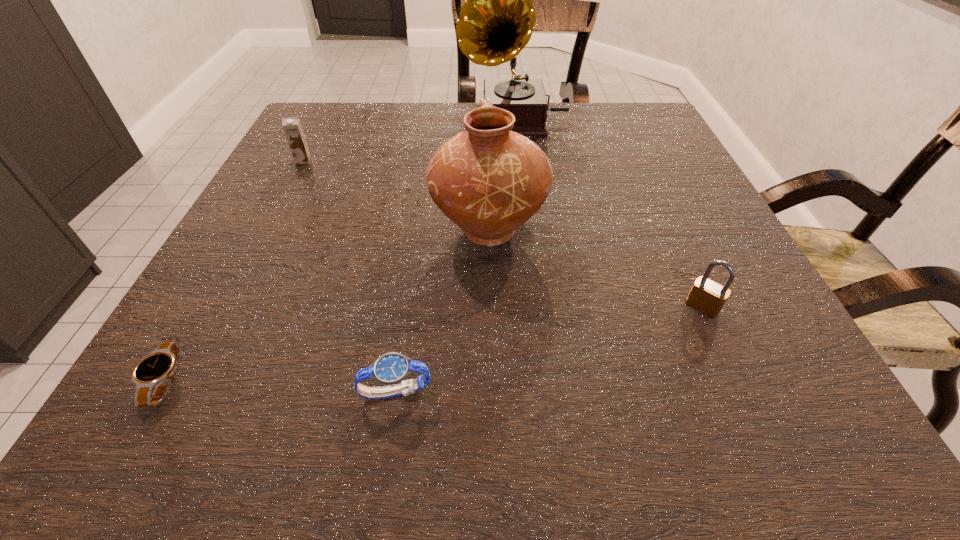
Where is `the shorter watch`? Image resolution: width=960 pixels, height=540 pixels. the shorter watch is located at coordinates (156, 370).

Find the location of a particular element. vacant region located 0.280m from the horn of the tallest object is located at coordinates (348, 120).

At what (x,y) coordinates should I click in order to perform the action: click on free region located 0.070m from the horn of the tallest object. Please return your answer as a coordinate pair (x, y). This screenshot has width=960, height=540. Looking at the image, I should click on (431, 120).

The image size is (960, 540). What are the coordinates of `free point located from the horn of the tallest object` in the screenshot? It's located at (407, 120).

Identify the location of vacant area situated on the side of the pottery with the handle. (487, 157).

In order to click on vacant area located 0.110m on the side of the pottery with the handle in this screenshot , I will do `click(487, 166)`.

Locate an element on the screen. This screenshot has height=540, width=960. vacant space located 0.080m on the side of the pottery with the handle is located at coordinates (487, 174).

Identify the location of vacant space located on the right of the second farthest object. click(410, 160).

The width and height of the screenshot is (960, 540). Find the location of `vacant space located 0.110m on the back of the rightmost object`. vacant space located 0.110m on the back of the rightmost object is located at coordinates (675, 249).

You are a GUI agent. You are given a task and a screenshot of the screen. Output one action in this format:
    pyautogui.click(x=<x>, y=<y>)
    Task: Click on the vacant space located 0.070m on the back of the right watch
    
    Given the screenshot: What is the action you would take?
    pyautogui.click(x=404, y=335)